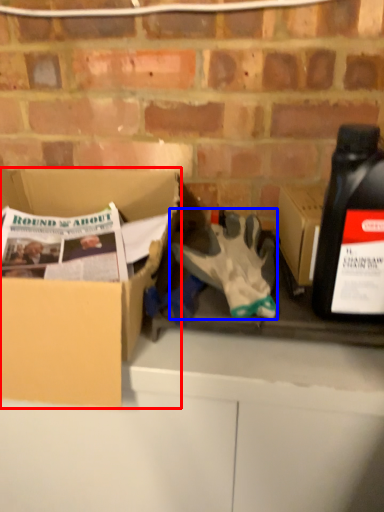
Question: Which of the following is the closest to the observer, box (highlighted by a red box) or glove (highlighted by a blue box)?

Choices:
 (A) box
 (B) glove

Answer: (A)